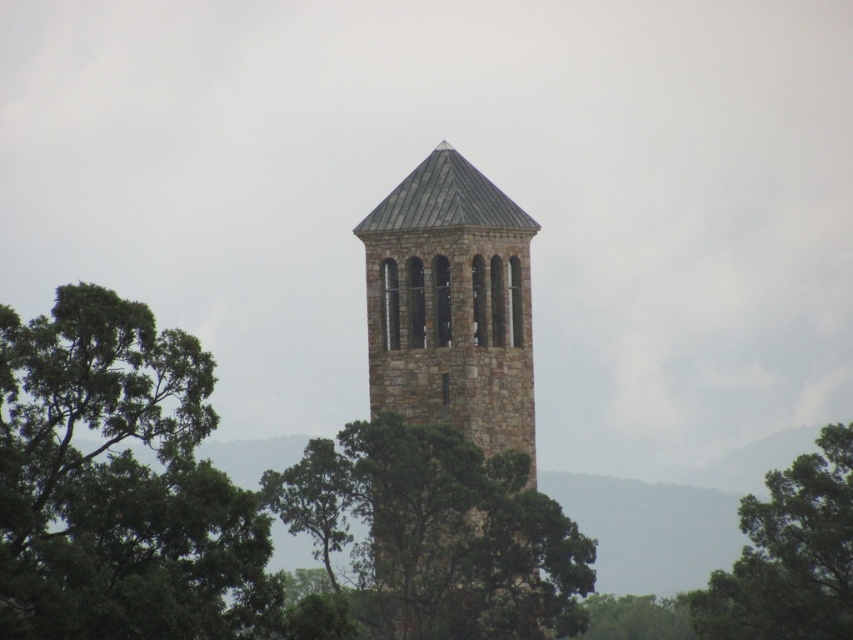
Is green leafy tree at center shorter than green leafy tree at lower center?

In fact, green leafy tree at center may be taller than green leafy tree at lower center.

Which is in front, point (390, 420) or point (657, 598)?

Point (390, 420)

I want to click on green leafy tree at center, so click(x=437, y=532).

Does point (6, 365) lie in front of point (828, 545)?

Yes, it is in front of point (828, 545).

Which is behind, point (10, 637) or point (712, 588)?

Positioned behind is point (712, 588).

Locate an element on the screen. green leafy tree at left is located at coordinates (117, 483).

Looking at this image, can you confirm if green leafy tree at left is shorter than stone textured tower at center?

Yes, green leafy tree at left is shorter than stone textured tower at center.

How distant is green leafy tree at left from stone textured tower at center?

33.55 meters

Is point (192, 390) farther from camera compared to point (415, 221)?

That is False.

Locate an element on the screen. The width and height of the screenshot is (853, 640). green leafy tree at left is located at coordinates (117, 483).